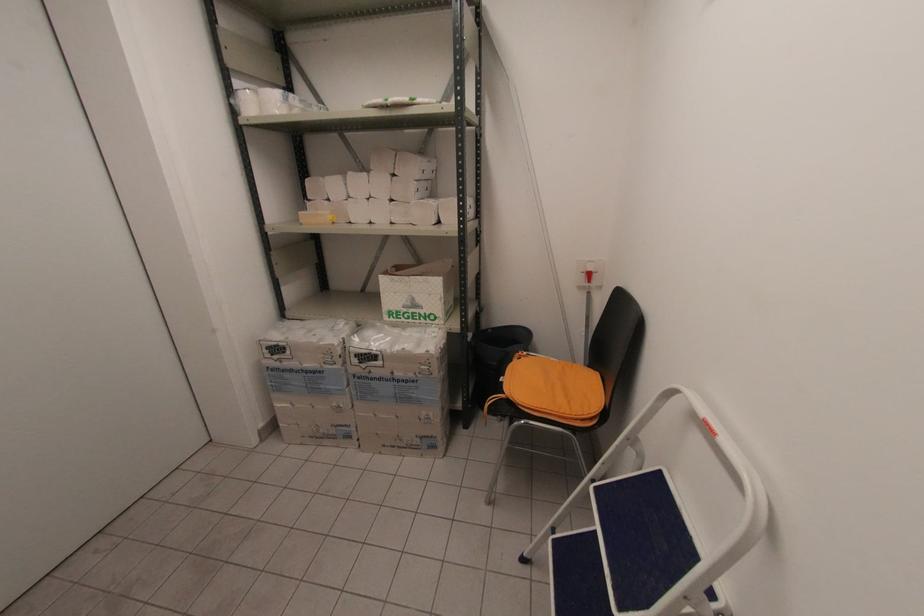
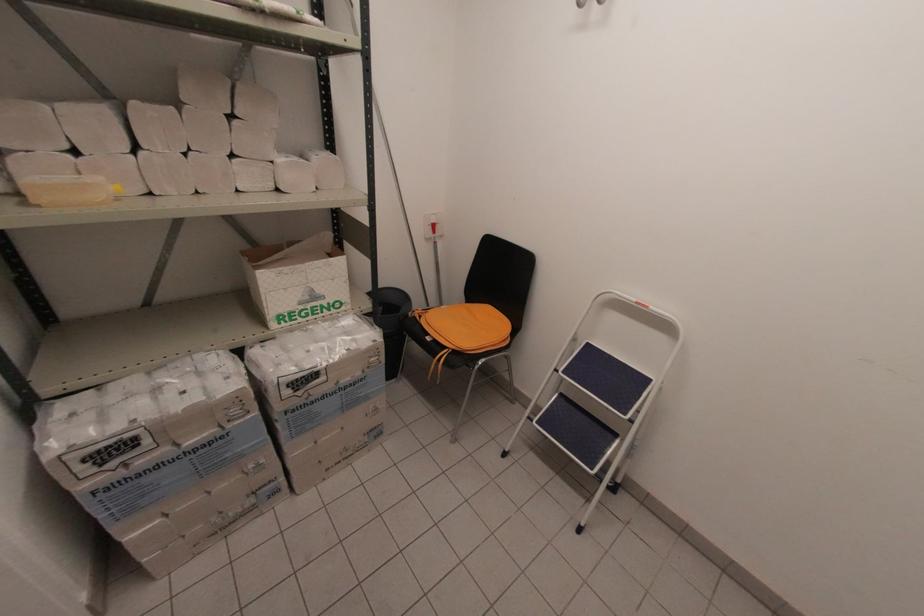
The point at (372, 379) is marked in the first image. Where is the corresponding point in the second image?

(312, 403)